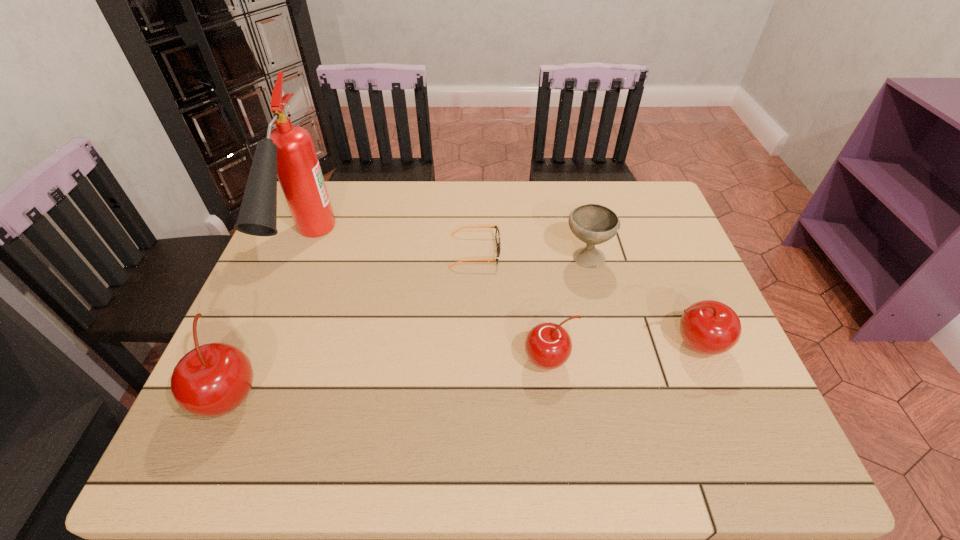
This screenshot has width=960, height=540. What are the coordinates of `the leftmost cherry` in the screenshot? It's located at (213, 379).

In order to click on the second cherry from right to left in this screenshot , I will do `click(548, 346)`.

Locate an element on the screen. the shortest cherry is located at coordinates (548, 346).

What are the coordinates of `the rightmost cherry` in the screenshot? It's located at (708, 327).

Where is `the second shortest cherry`? the second shortest cherry is located at coordinates (708, 327).

The image size is (960, 540). I want to click on the tallest object, so click(288, 152).

The image size is (960, 540). What are the coordinates of `spectacles` in the screenshot? It's located at (497, 235).

This screenshot has height=540, width=960. I want to click on the fourth object from right to left, so click(497, 235).

Image resolution: width=960 pixels, height=540 pixels. Find the location of `the fifth object from left to right`. the fifth object from left to right is located at coordinates (593, 224).

You are a GUI agent. You are given a task and a screenshot of the screen. Output one action in this format:
    pyautogui.click(x=<x>, y=<y>)
    Task: Click on the free space located on the back of the leftmost cherry
    
    Given the screenshot: What is the action you would take?
    pyautogui.click(x=281, y=279)